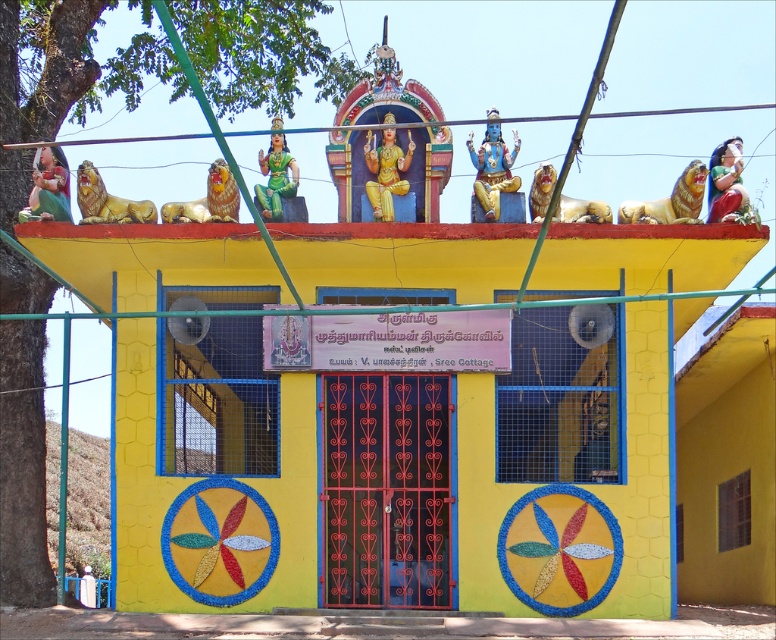
Between matte green statue at upper center and gold metallic lion at upper right, which one has less height?

gold metallic lion at upper right is shorter.

Identify the location of matte green statue at upper center. This screenshot has width=776, height=640. (728, 186).

Who is lower down, matte green statue at upper center or green glossy statue at center?

matte green statue at upper center

Measure the distance from matte green statue at upper center to green glossy statue at center.

58.94 feet

Locate an element on the screen. The image size is (776, 640). matte green statue at upper center is located at coordinates (728, 186).

Is point (489, 195) positioned before point (366, 148)?

Yes, it is.

Can you confirm if blue metallic statue at upper center is thinner than gold metallic statue at center?

In fact, blue metallic statue at upper center might be wider than gold metallic statue at center.

Describe the element at coordinates (492, 168) in the screenshot. Image resolution: width=776 pixels, height=640 pixels. I see `blue metallic statue at upper center` at that location.

Locate an element on the screen. blue metallic statue at upper center is located at coordinates (492, 168).